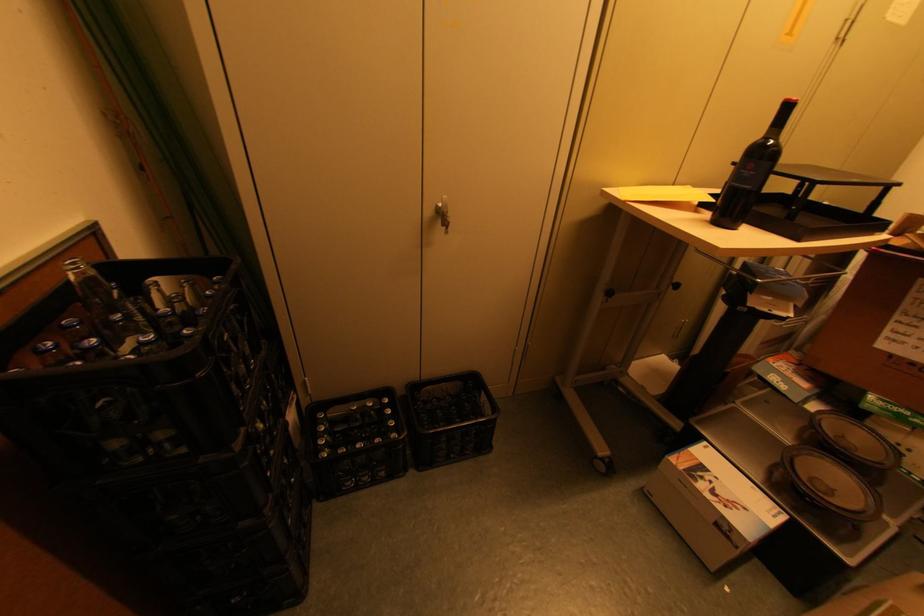
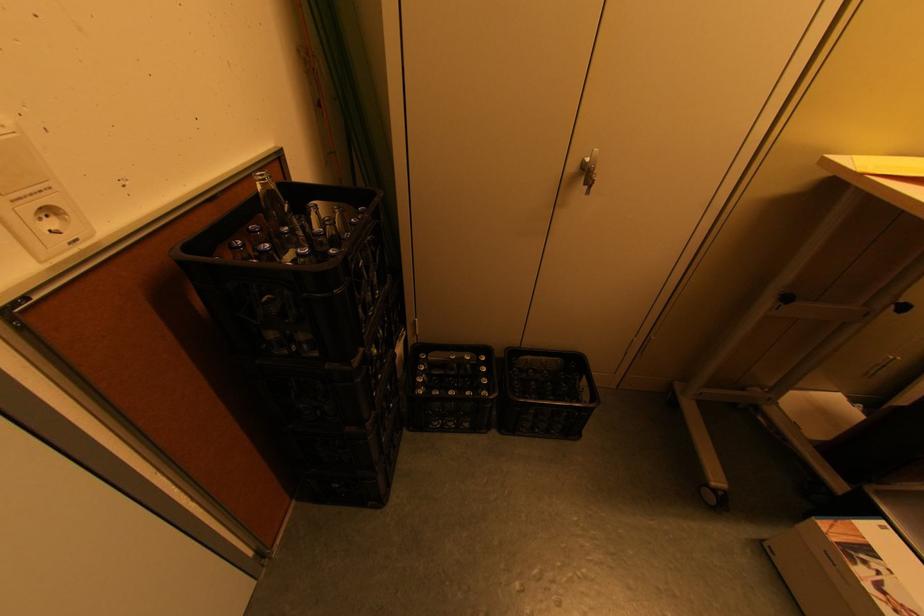
In the second image, find the point that corresponds to (x=441, y=207) in the first image.

(587, 161)